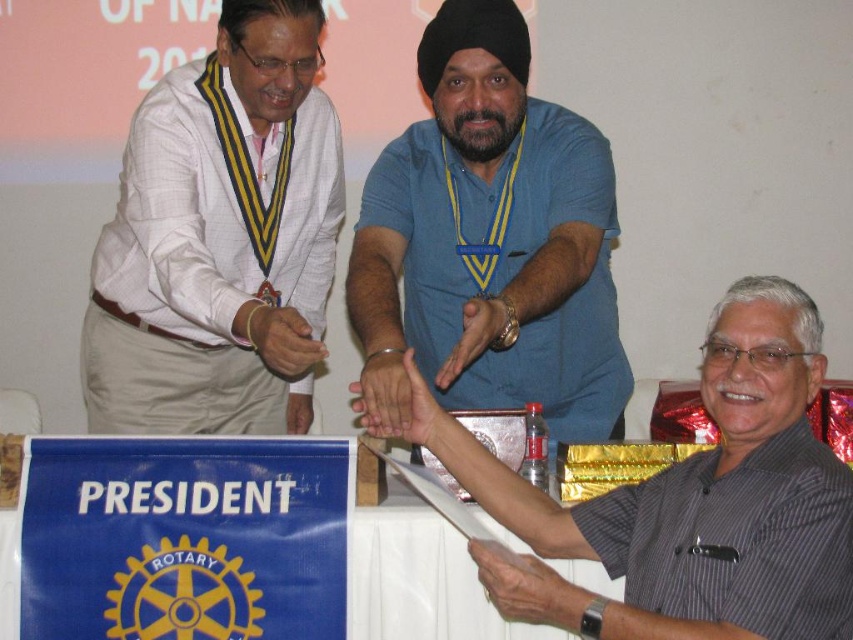
In the scene shown: You are attending a formal event and notice two individuals wearing a white textured shirt at left and a gray striped shirt at center. Which person is standing in front of the other?

The white textured shirt at left is positioned over gray striped shirt at center, so the person wearing the white textured shirt at left is standing in front of the person in the gray striped shirt at center.